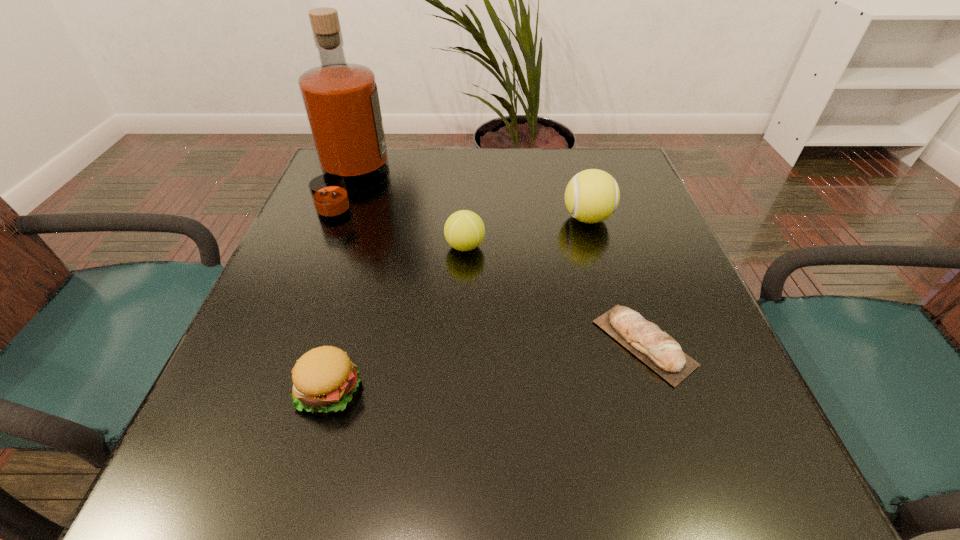
This screenshot has width=960, height=540. I want to click on free spot at the left edge of the desktop, so click(245, 330).

This screenshot has height=540, width=960. What are the coordinates of `vacant area at the right edge` in the screenshot? It's located at (709, 342).

Locate an element on the screen. Image resolution: width=960 pixels, height=540 pixels. free space at the near left corner of the desktop is located at coordinates (237, 475).

Where is `free spot at the far right corner of the desktop`? free spot at the far right corner of the desktop is located at coordinates (598, 154).

Locate an element on the screen. vacant space at the near right corner of the desktop is located at coordinates (706, 476).

Where is `free space between the second tallest object and the tallest object`? free space between the second tallest object and the tallest object is located at coordinates (469, 202).

You are a GUI agent. You are given a task and a screenshot of the screen. Output one action in this format:
    pyautogui.click(x=<x>, y=<y>)
    Task: Click on the free space between the liquor and the hamburger
    The height and width of the screenshot is (540, 960).
    Given the screenshot: What is the action you would take?
    pyautogui.click(x=341, y=288)

You are a GUI agent. You are given a task and a screenshot of the screen. Output one action in this format:
    pyautogui.click(x=<x>, y=<y>)
    Task: Click on the blank region between the shorter tennis ball and the shortest object
    The width and height of the screenshot is (960, 540).
    Given the screenshot: What is the action you would take?
    pyautogui.click(x=554, y=295)

Image resolution: width=960 pixels, height=540 pixels. I want to click on empty space between the third tallest object and the right tennis ball, so click(526, 232).

Image resolution: width=960 pixels, height=540 pixels. Identify the location of unoccupied area between the third shortest object and the pita bread. (554, 295).